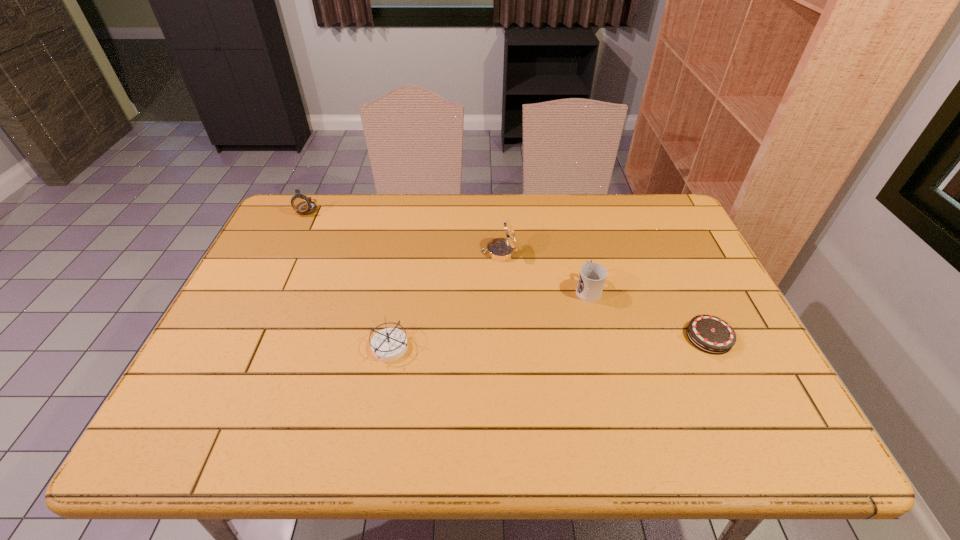
This screenshot has height=540, width=960. I want to click on vacant area that lies between the third tallest object and the second object from left to right, so click(x=490, y=318).

Where is `vacant region between the fourth nearest object and the second object from left to right`? vacant region between the fourth nearest object and the second object from left to right is located at coordinates (445, 300).

Where is `free spot between the leftmost compass and the third object from right to left`? free spot between the leftmost compass and the third object from right to left is located at coordinates (403, 230).

Find the location of a particular element. This screenshot has width=960, height=540. free area in between the second farthest object and the cup is located at coordinates (543, 271).

Locate an element on the screen. vacant space in between the leftmost compass and the rightmost compass is located at coordinates (403, 230).

You are a GUI agent. You are given a task and a screenshot of the screen. Output one action in this format:
    pyautogui.click(x=<x>, y=<y>)
    Task: Click on the empty space between the second compass from right to left and the rightmost object
    The image size is (960, 540).
    Given the screenshot: What is the action you would take?
    pyautogui.click(x=550, y=342)

At what (x,y) coordinates should I click in order to perform the action: click on free spot between the chocolate cake and the second compass from left to right. Please return your answer as a coordinate pair (x, y). The image size is (960, 540). Looking at the image, I should click on (550, 342).

Where is `blank region between the leftmost compass and the third tallest object`? Image resolution: width=960 pixels, height=540 pixels. blank region between the leftmost compass and the third tallest object is located at coordinates (447, 248).

Locate an element on the screen. The image size is (960, 540). free space between the fourth nearest object and the farthest compass is located at coordinates (403, 230).

The width and height of the screenshot is (960, 540). I want to click on free space between the chocolate cake and the leftmost object, so click(x=509, y=273).